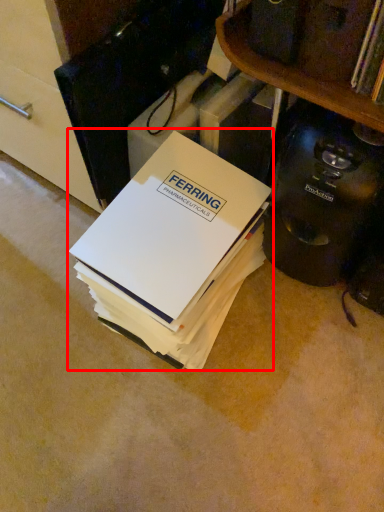
Question: Considering the relative positions of paperback book (annotated by the red box) and home appliance in the image provided, where is paperback book (annotated by the red box) located with respect to the staircase?

Choices:
 (A) right
 (B) left

Answer: (B)